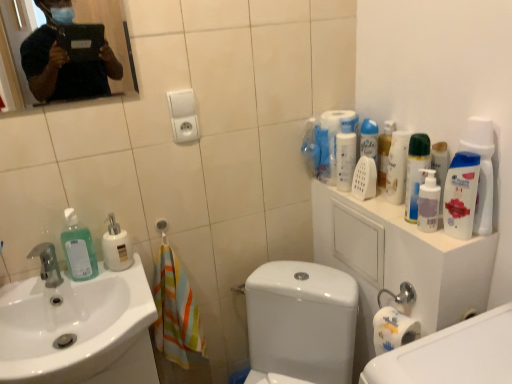
Question: Should I look upward or downward to see green matte spray can at upper right, which is the fifth cleaning product in left-to-right order?

Choices:
 (A) down
 (B) up

Answer: (B)

Question: Is white glossy soap dispenser at left, which is the fifth cleaning product from right to left, wider than white glossy mouthwash at upper right, which ranks as the second mouthwash in back-to-front order?

Choices:
 (A) yes
 (B) no

Answer: (A)

Question: Is white glossy soap dispenser at left, arranged as the second cleaning product when viewed from the left, to the left of white glossy mouthwash at upper right, which is counted as the first mouthwash, starting from the front, from the viewer's perspective?

Choices:
 (A) no
 (B) yes

Answer: (B)

Question: Is white glossy soap dispenser at left, arranged as the second cleaning product when viewed from the left, taller than white glossy mouthwash at upper right, which is the first mouthwash from right to left?

Choices:
 (A) yes
 (B) no

Answer: (B)

Question: Considering the relative sizes of white glossy soap dispenser at left, arranged as the second cleaning product when viewed from the left, and white glossy mouthwash at upper right, which is counted as the 2th mouthwash, starting from the left, in the image provided, is white glossy soap dispenser at left, arranged as the second cleaning product when viewed from the left, smaller than white glossy mouthwash at upper right, which is counted as the 2th mouthwash, starting from the left,?

Choices:
 (A) yes
 (B) no

Answer: (B)

Question: Is white glossy soap dispenser at left, which is the fifth cleaning product from right to left, completely or partially outside of white glossy mouthwash at upper right, which ranks as the second mouthwash in back-to-front order?

Choices:
 (A) yes
 (B) no

Answer: (A)

Question: Is white glossy soap dispenser at left, arranged as the second cleaning product when viewed from the left, oriented away from white glossy mouthwash at upper right, which is counted as the first mouthwash, starting from the front?

Choices:
 (A) yes
 (B) no

Answer: (B)

Question: From the image's perspective, would you say green matte spray can at upper right, which is counted as the second cleaning product, starting from the right, is positioned over white glossy mouthwash at upper right, which ranks as the second mouthwash in back-to-front order?

Choices:
 (A) no
 (B) yes

Answer: (B)

Question: Would you say green matte spray can at upper right, which is the fifth cleaning product in left-to-right order, is a long distance from white glossy mouthwash at upper right, which is counted as the 2th mouthwash, starting from the left?

Choices:
 (A) yes
 (B) no

Answer: (B)

Question: From a real-world perspective, is green matte spray can at upper right, which is counted as the second cleaning product, starting from the right, on top of white glossy mouthwash at upper right, which ranks as the second mouthwash in back-to-front order?

Choices:
 (A) no
 (B) yes

Answer: (B)

Question: Considering the relative sizes of green matte spray can at upper right, which is the fifth cleaning product in left-to-right order, and white glossy mouthwash at upper right, which ranks as the second mouthwash in back-to-front order, in the image provided, is green matte spray can at upper right, which is the fifth cleaning product in left-to-right order, taller than white glossy mouthwash at upper right, which ranks as the second mouthwash in back-to-front order,?

Choices:
 (A) yes
 (B) no

Answer: (A)

Question: Can you confirm if green matte spray can at upper right, which is the fifth cleaning product in left-to-right order, is shorter than white glossy mouthwash at upper right, which is counted as the first mouthwash, starting from the front?

Choices:
 (A) no
 (B) yes

Answer: (A)

Question: Is the position of green matte spray can at upper right, which is the fifth cleaning product in left-to-right order, less distant than that of white glossy mouthwash at upper right, which is the first mouthwash from right to left?

Choices:
 (A) no
 (B) yes

Answer: (A)

Question: Does white glossy sink at lower left have a lesser height compared to green matte soap dispenser at left, acting as the 6th cleaning product starting from the right?

Choices:
 (A) yes
 (B) no

Answer: (B)